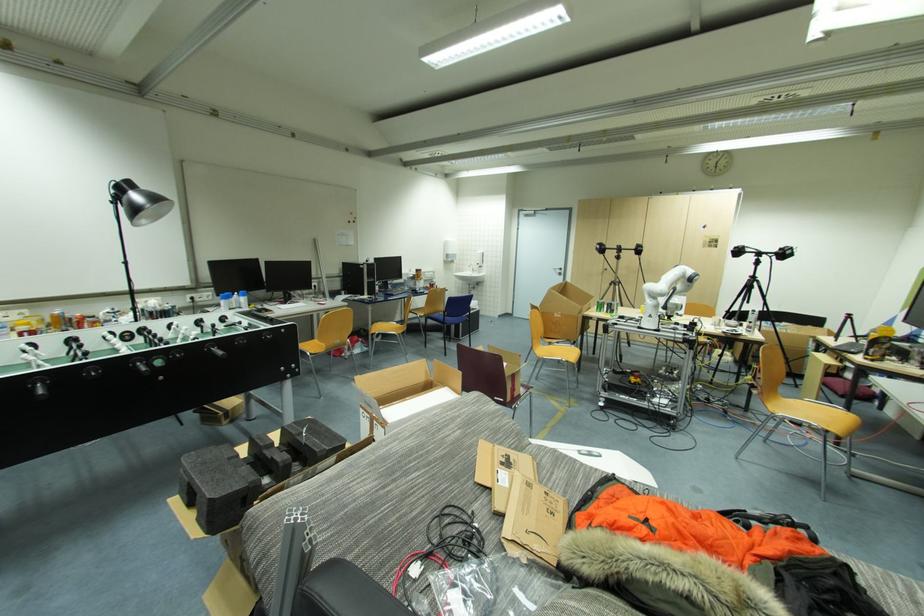
Find the location of a particular element. This screenshot has width=924, height=616. silver door handle is located at coordinates (557, 270).